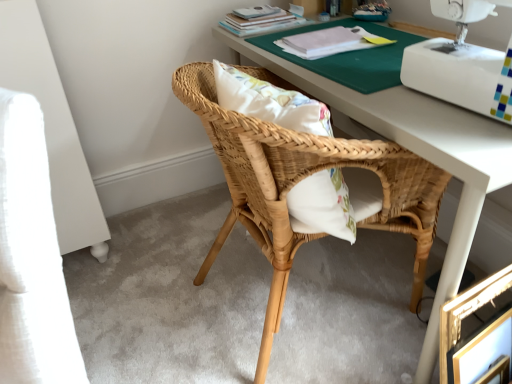
Image resolution: width=512 pixels, height=384 pixels. Identify the location of free space in front of white plastic sewing machine at upper right. (466, 135).